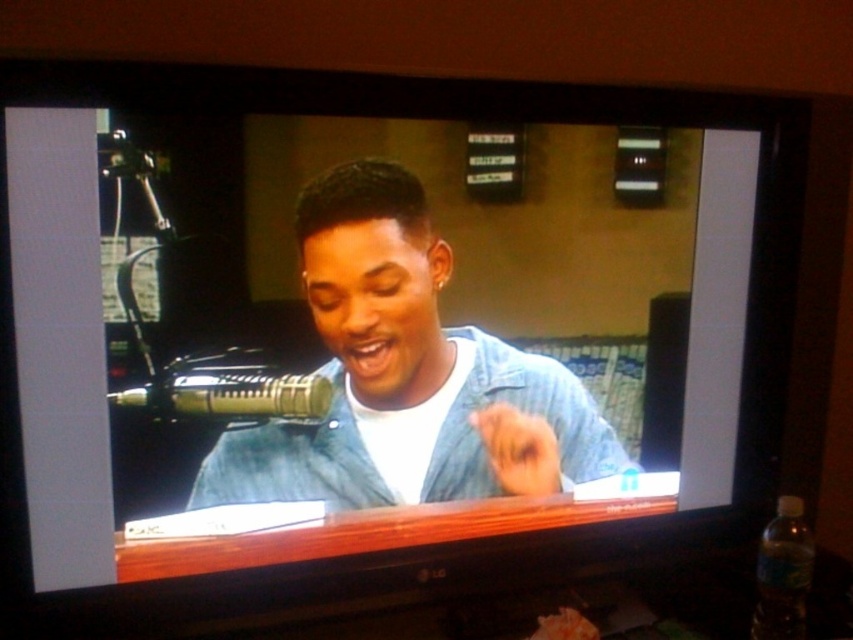
Is denim shirt at center above metallic gold microphone at left?

No, denim shirt at center is not above metallic gold microphone at left.

Does denim shirt at center appear under metallic gold microphone at left?

Yes.

Is point (412, 250) closer to camera compared to point (158, 385)?

No, (412, 250) is further to viewer.

At what (x,y) coordinates should I click in order to perform the action: click on denim shirt at center. Please return your answer as a coordinate pair (x, y). The width and height of the screenshot is (853, 640). Looking at the image, I should click on (405, 376).